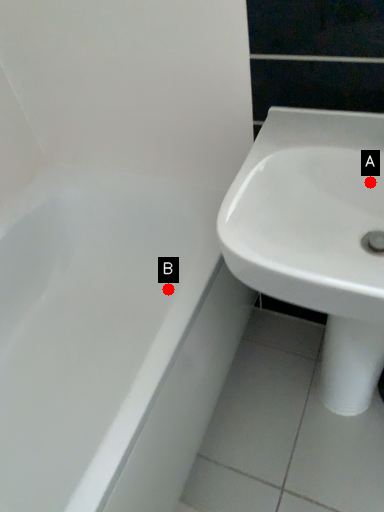
Question: Two points are circled on the image, labeled by A and B beside each circle. Which of the following is the closest to the observer?

Choices:
 (A) A is closer
 (B) B is closer

Answer: (A)